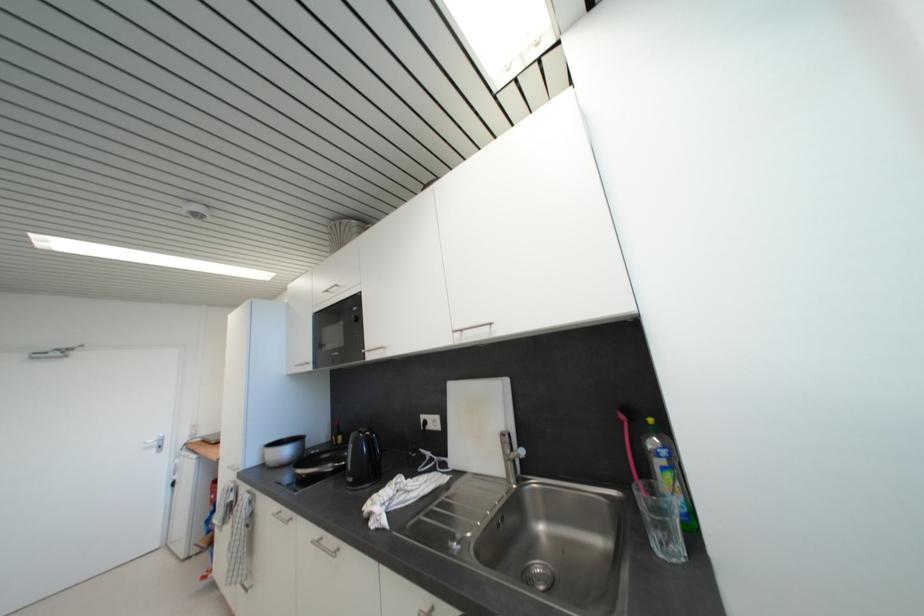
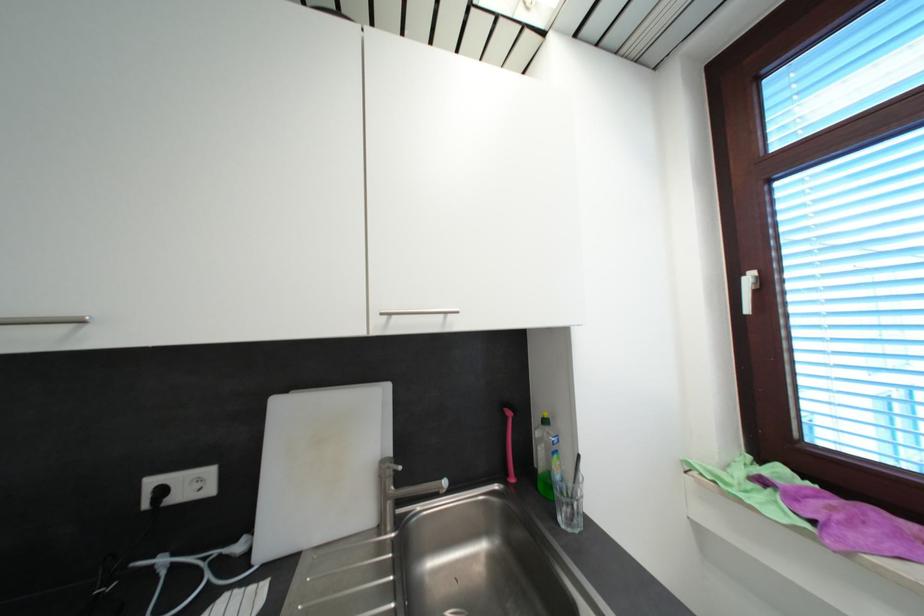
Question: The first image is from the beginning of the video and the second image is from the end. How did the camera likely rotate when shooting the video?

Choices:
 (A) Left
 (B) Right
 (C) Up
 (D) Down

Answer: (B)